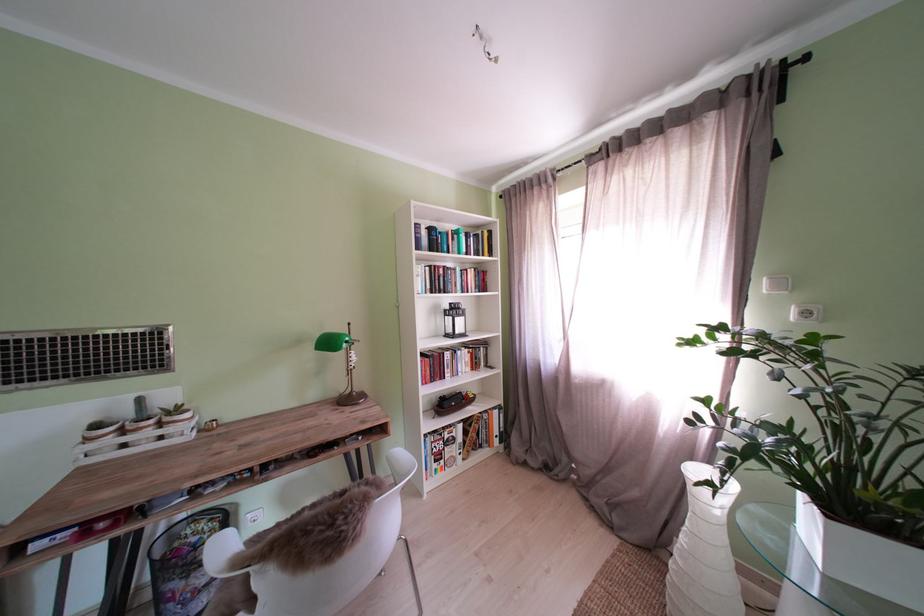
The height and width of the screenshot is (616, 924). Find the location of `green lamp shade`. green lamp shade is located at coordinates (332, 342).